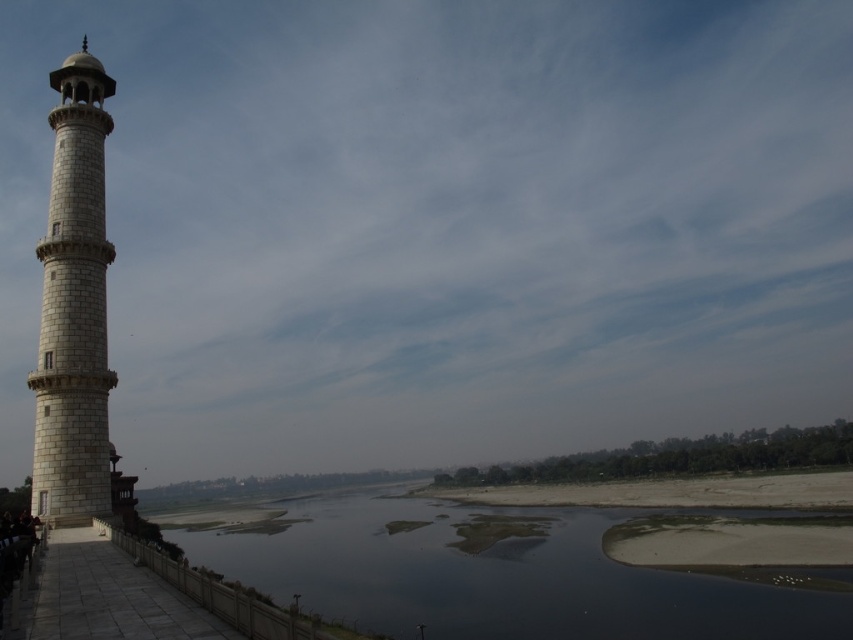
What do you see at coordinates (491, 573) in the screenshot? I see `dark water at lower center` at bounding box center [491, 573].

Does dark water at lower center appear under white stone tower at left?

Correct, dark water at lower center is located below white stone tower at left.

Describe the element at coordinates (491, 573) in the screenshot. I see `dark water at lower center` at that location.

This screenshot has width=853, height=640. Find the location of `dark water at lower center`. dark water at lower center is located at coordinates (491, 573).